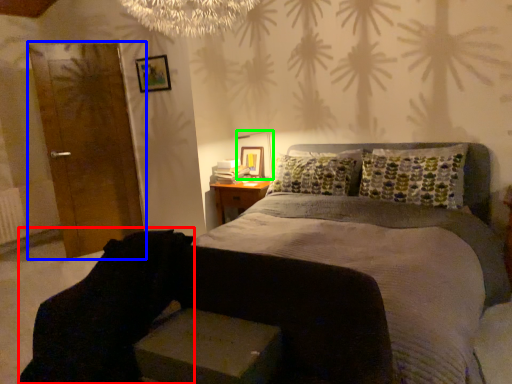
Question: Which object is the closest to the swivel chair (highlighted by a red box)? Choose among these: armoire (highlighted by a blue box) or table lamp (highlighted by a green box).

Choices:
 (A) armoire
 (B) table lamp

Answer: (B)